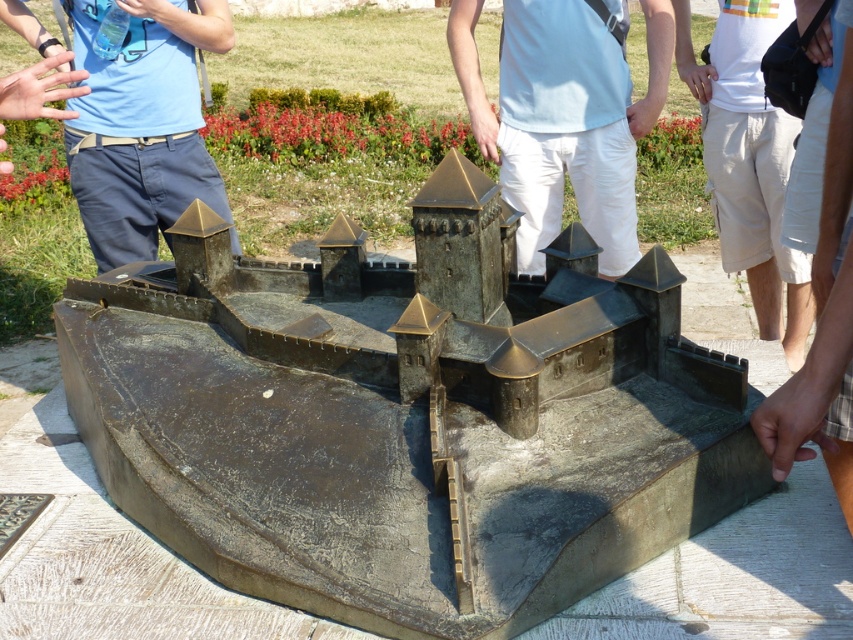
Question: Does bronze sculpture at center appear on the left side of white matte pants at center?

Choices:
 (A) yes
 (B) no

Answer: (A)

Question: Does bronze sculpture at center appear on the right side of white matte pants at center?

Choices:
 (A) yes
 (B) no

Answer: (B)

Question: Which object appears farthest from the camera in this image?

Choices:
 (A) bronze sculpture at center
 (B) white matte pants at center

Answer: (B)

Question: Does bronze sculpture at center appear on the left side of white matte pants at center?

Choices:
 (A) no
 (B) yes

Answer: (B)

Question: Which point appears closest to the camera in this image?

Choices:
 (A) (618, 218)
 (B) (613, 449)

Answer: (B)